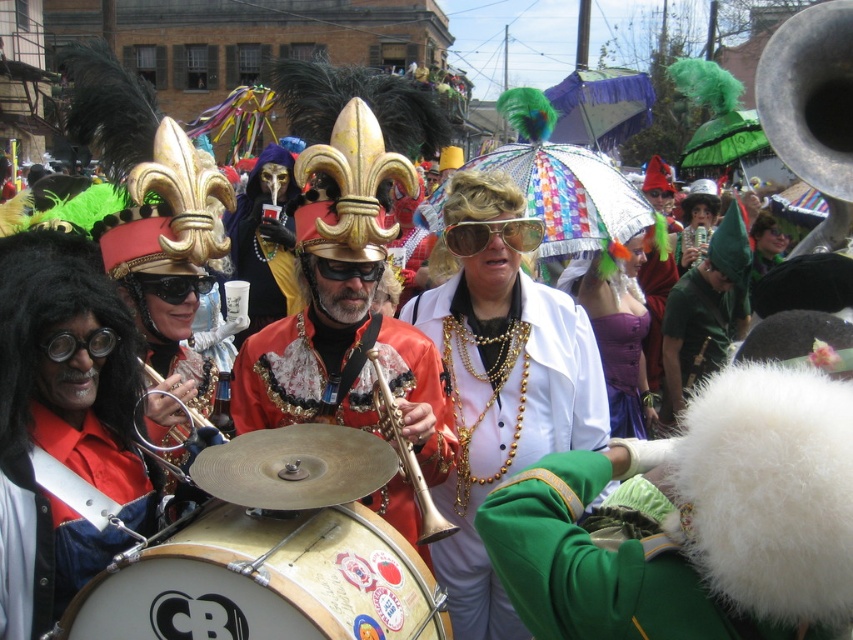
You are a photographer at the Mardi Gras parade and want to capture a photo of both the gold metallic drum at center and the gold reflective sunglasses at center. Which object should you focus on first if you want to ensure both are in focus without moving the camera?

The gold metallic drum at center is located below gold reflective sunglasses at center, so you should focus on the gold reflective sunglasses at center first since it is farther away, ensuring the drum will also be in focus if the depth of field is set appropriately.

You are a performer in the Mardi Gras parade and need to carry both the gold metallic drum at center and the gold brass trumpet at center. Based on their sizes, which one should you carry in your arms and which one on your shoulder?

The gold metallic drum at center is wider than the gold brass trumpet at center, so you should carry the gold metallic drum at center in your arms and the gold brass trumpet at center on your shoulder.